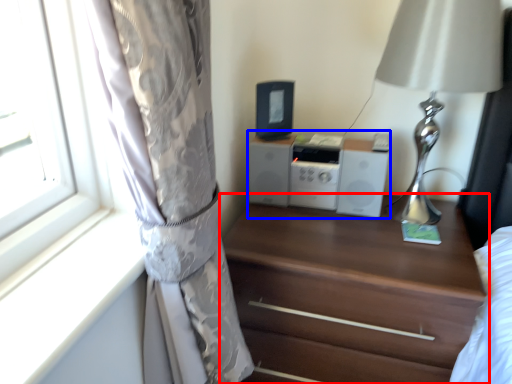
Question: Which of the following is the farthest to the observer, chest of drawers (highlighted by a red box) or stereo (highlighted by a blue box)?

Choices:
 (A) chest of drawers
 (B) stereo

Answer: (B)